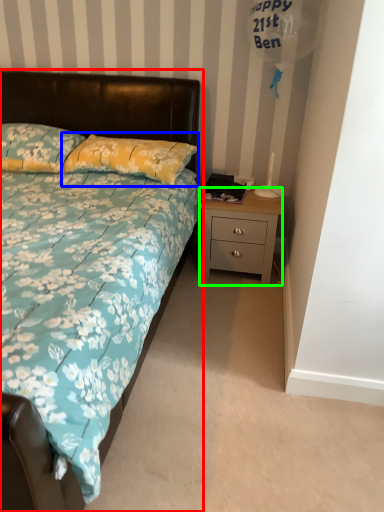
Question: Which object is positioned closest to bed (highlighted by a red box)? Select from pillow (highlighted by a blue box) and nightstand (highlighted by a green box).

Choices:
 (A) pillow
 (B) nightstand

Answer: (A)